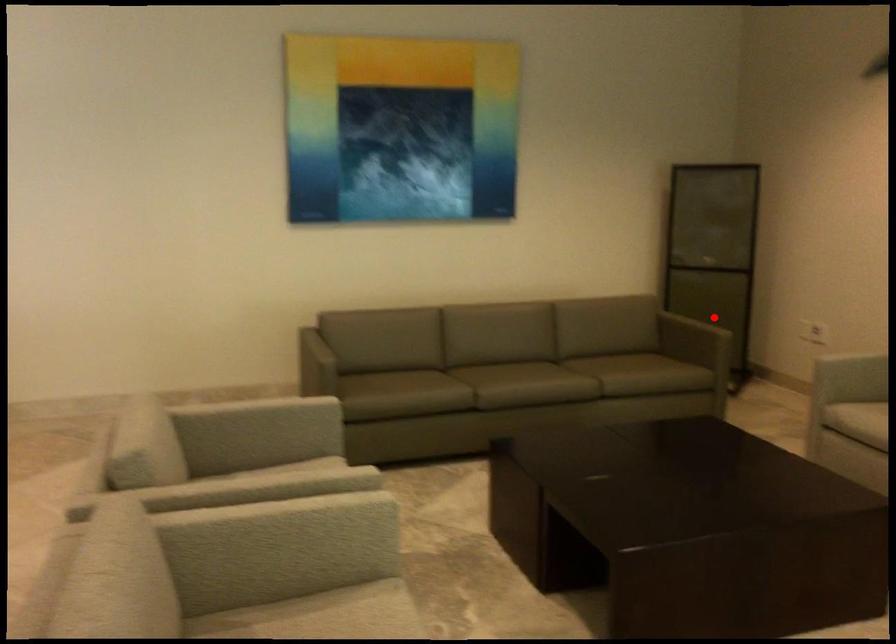
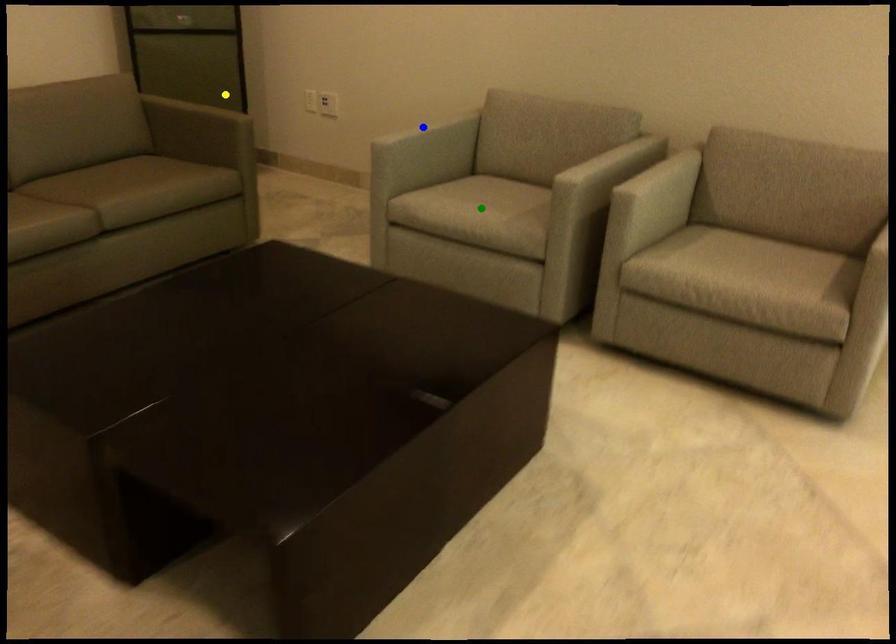
Question: I am providing you with two images of the same scene from different viewpoints. A red point is marked on the first image. You are given multiple points on the second image. In image 2, which mark is for the same physical point as the one in image 1?

Choices:
 (A) blue point
 (B) green point
 (C) yellow point

Answer: (C)